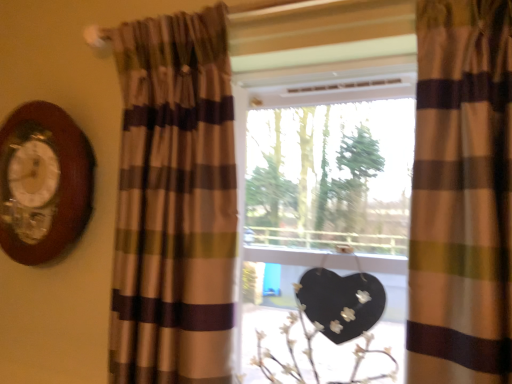
Question: Is brown striped curtain at left, marked as the second curtain in a right-to-left arrangement, facing away from brown striped curtain at right, acting as the first curtain starting from the right?

Choices:
 (A) yes
 (B) no

Answer: (B)

Question: Does brown striped curtain at left, marked as the second curtain in a right-to-left arrangement, have a smaller size compared to brown striped curtain at right, the 2th curtain from the left?

Choices:
 (A) no
 (B) yes

Answer: (A)

Question: Considering the relative sizes of brown striped curtain at left, marked as the second curtain in a right-to-left arrangement, and brown striped curtain at right, acting as the first curtain starting from the right, in the image provided, is brown striped curtain at left, marked as the second curtain in a right-to-left arrangement, shorter than brown striped curtain at right, acting as the first curtain starting from the right,?

Choices:
 (A) yes
 (B) no

Answer: (B)

Question: Can you confirm if brown striped curtain at left, which is the first curtain in left-to-right order, is positioned to the right of brown striped curtain at right, acting as the first curtain starting from the right?

Choices:
 (A) no
 (B) yes

Answer: (A)

Question: From a real-world perspective, is brown striped curtain at left, which is the first curtain in left-to-right order, located beneath brown striped curtain at right, the 2th curtain from the left?

Choices:
 (A) yes
 (B) no

Answer: (A)

Question: Is brown striped curtain at left, which is the first curtain in left-to-right order, outside brown striped curtain at right, the 2th curtain from the left?

Choices:
 (A) yes
 (B) no

Answer: (A)

Question: Is white matte floral arrangement at center further to camera compared to matte glass window at center?

Choices:
 (A) no
 (B) yes

Answer: (B)

Question: Is there a large distance between white matte floral arrangement at center and matte glass window at center?

Choices:
 (A) no
 (B) yes

Answer: (A)

Question: From the image's perspective, is white matte floral arrangement at center on top of matte glass window at center?

Choices:
 (A) no
 (B) yes

Answer: (A)

Question: Is white matte floral arrangement at center positioned before matte glass window at center?

Choices:
 (A) yes
 (B) no

Answer: (B)

Question: Does white matte floral arrangement at center have a smaller size compared to matte glass window at center?

Choices:
 (A) no
 (B) yes

Answer: (B)

Question: Does white matte floral arrangement at center appear on the left side of matte glass window at center?

Choices:
 (A) no
 (B) yes

Answer: (A)

Question: Could brown striped curtain at left, which is the first curtain in left-to-right order, be considered to be inside white matte floral arrangement at center?

Choices:
 (A) yes
 (B) no

Answer: (B)